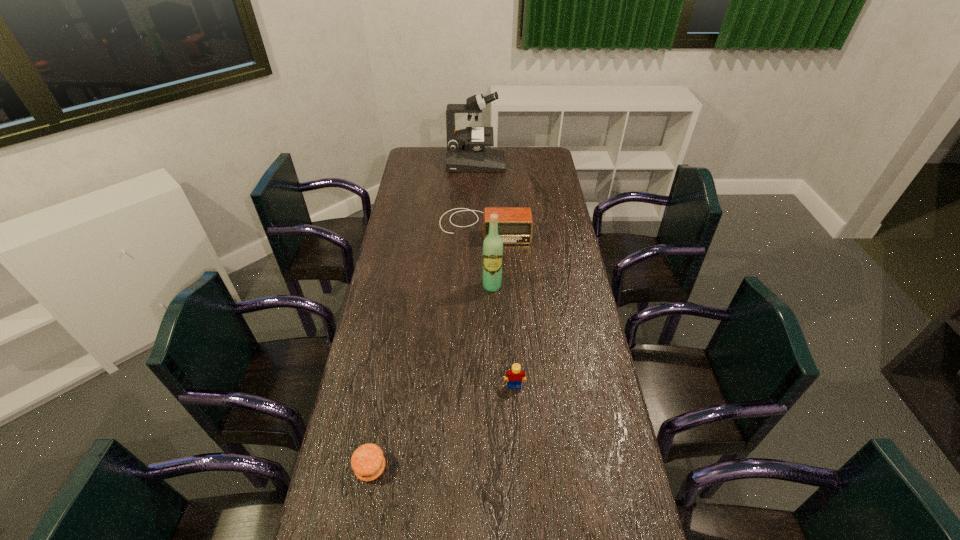
Image resolution: width=960 pixels, height=540 pixels. In order to click on free region located on the right of the shortest object in this screenshot , I will do `click(492, 468)`.

Locate an element on the screen. The width and height of the screenshot is (960, 540). object present at the far edge is located at coordinates (465, 152).

You are a GUI agent. You are given a task and a screenshot of the screen. Output one action in this format:
    pyautogui.click(x=<x>, y=<y>)
    Task: Click on the object at the left edge
    
    Given the screenshot: What is the action you would take?
    pyautogui.click(x=368, y=462)

Identify the location of vacant space at the left edge of the desktop. The image size is (960, 540). (395, 253).

The width and height of the screenshot is (960, 540). In order to click on vacant space at the right edge of the desktop in this screenshot , I will do `click(618, 530)`.

In the image, there is a desktop. In order to click on vacant region at the far right corner in this screenshot , I will do `click(543, 155)`.

At what (x,y) coordinates should I click in order to perform the action: click on free area in between the fourth farthest object and the leftmost object. Please return your answer as a coordinate pair (x, y). The height and width of the screenshot is (540, 960). Looking at the image, I should click on click(x=443, y=427).

At what (x,y) coordinates should I click in order to perform the action: click on free space between the Lego and the fourth nearest object. Please return your answer as a coordinate pair (x, y). Looking at the image, I should click on (499, 306).

I want to click on free point between the Lego and the third farthest object, so click(503, 336).

Find the location of `empty space that is in between the shortest object and the wine bottle`. empty space that is in between the shortest object and the wine bottle is located at coordinates (431, 377).